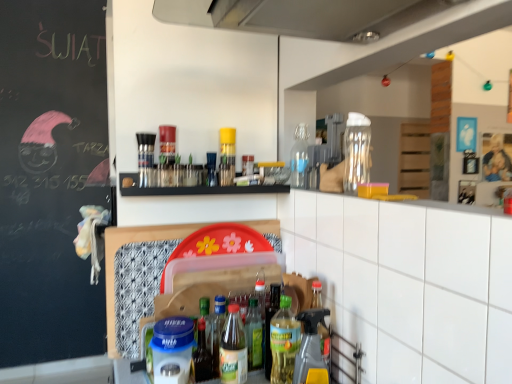
The height and width of the screenshot is (384, 512). What do you see at coordinates (202, 355) in the screenshot?
I see `translucent plastic bottle at center, the tenth bottle from the right` at bounding box center [202, 355].

Where is `translucent plastic bottle at center, acting as the 3th bottle starting from the left`? translucent plastic bottle at center, acting as the 3th bottle starting from the left is located at coordinates (211, 169).

Describe the element at coordinates (247, 165) in the screenshot. I see `translucent glass bottle at center, marked as the 6th bottle in a right-to-left arrangement` at that location.

Where is `transparent glass bottle at upper center, which is the first bottle in right-to-left order`? transparent glass bottle at upper center, which is the first bottle in right-to-left order is located at coordinates [x=356, y=152].

You are a GUI agent. You are given a task and a screenshot of the screen. Output one action in this format:
    pyautogui.click(x=<x>, y=<y>)
    Task: Click on the green glass bottle at center, which ranks as the fifth bottle in right-to-left order
    
    Given the screenshot: What is the action you would take?
    pyautogui.click(x=254, y=335)

Which object is further away from the camera, translucent plastic bottle at center, which is counted as the fifth bottle, starting from the left, or translucent plastic bottle at center, which is the second bottle in left-to-right order?

translucent plastic bottle at center, which is the second bottle in left-to-right order, is further away from the camera.

Is point (243, 345) farther from camera compared to point (202, 380)?

Yes, it is behind point (202, 380).

Is translucent plastic bottle at center, arranged as the seventh bottle when viewed from the right, oriented away from translucent plastic bottle at center, which is the second bottle in left-to-right order?

No, translucent plastic bottle at center, arranged as the seventh bottle when viewed from the right, is not facing the opposite direction of translucent plastic bottle at center, which is the second bottle in left-to-right order.

Is translucent plastic bottle at center, which is counted as the fifth bottle, starting from the left, thinner than translucent plastic bottle at center, which is the second bottle in left-to-right order?

No, translucent plastic bottle at center, which is counted as the fifth bottle, starting from the left, is not thinner than translucent plastic bottle at center, which is the second bottle in left-to-right order.

Between translucent plastic bottle at center, the tenth bottle from the right, and translucent plastic bottle at center, arranged as the seventh bottle when viewed from the right, which one has larger width?

With larger width is translucent plastic bottle at center, arranged as the seventh bottle when viewed from the right.

Is translucent plastic bottle at center, which is the second bottle in left-to-right order, positioned beyond the bounds of translucent plastic bottle at center, which is counted as the fifth bottle, starting from the left?

Absolutely, translucent plastic bottle at center, which is the second bottle in left-to-right order, is external to translucent plastic bottle at center, which is counted as the fifth bottle, starting from the left.

Is translucent plastic bottle at center, which is the second bottle in left-to-right order, aimed at translucent plastic bottle at center, which is counted as the fifth bottle, starting from the left?

No, translucent plastic bottle at center, which is the second bottle in left-to-right order, is not turned towards translucent plastic bottle at center, which is counted as the fifth bottle, starting from the left.

Would you consider translucent plastic bottle at center, which is counted as the fifth bottle, starting from the left, to be distant from transparent glass bottle at upper center, placed as the 2th bottle when sorted from right to left?

No, there isn't a large distance between translucent plastic bottle at center, which is counted as the fifth bottle, starting from the left, and transparent glass bottle at upper center, placed as the 2th bottle when sorted from right to left.

From the picture: Who is smaller, translucent plastic bottle at center, arranged as the seventh bottle when viewed from the right, or transparent glass bottle at upper center, placed as the 2th bottle when sorted from right to left?

With smaller size is translucent plastic bottle at center, arranged as the seventh bottle when viewed from the right.

Consider the image. Which object is thinner, translucent plastic bottle at center, arranged as the seventh bottle when viewed from the right, or transparent glass bottle at upper center, which is counted as the tenth bottle, starting from the left?

Thinner between the two is transparent glass bottle at upper center, which is counted as the tenth bottle, starting from the left.

From the image's perspective, is translucent plastic bottle at center, arranged as the seventh bottle when viewed from the right, located above or below transparent glass bottle at upper center, placed as the 2th bottle when sorted from right to left?

Based on their image positions, translucent plastic bottle at center, arranged as the seventh bottle when viewed from the right, is located beneath transparent glass bottle at upper center, placed as the 2th bottle when sorted from right to left.

Considering the points (212, 338) and (234, 334), which point is behind, point (212, 338) or point (234, 334)?

The point (212, 338) is farther from the camera.

I want to click on the 4th bottle below the translucent plastic bottle at center, the eighth bottle in the right-to-left sequence (from the image's perspective), so 233,349.

Who is more distant, translucent plastic bottle at center, the eighth bottle in the right-to-left sequence, or translucent plastic bottle at center, which is counted as the fifth bottle, starting from the left?

translucent plastic bottle at center, the eighth bottle in the right-to-left sequence.

Which is nearer, (x=207, y=153) or (x=294, y=342)?

The point (x=294, y=342) is closer to the camera.

Is translucent plastic bottle at center, the ninth bottle in the right-to-left sequence, placed right next to green glass bottle at center, the eighth bottle from the left?

No, translucent plastic bottle at center, the ninth bottle in the right-to-left sequence, is not in contact with green glass bottle at center, the eighth bottle from the left.

Who is taller, translucent plastic bottle at center, the ninth bottle in the right-to-left sequence, or green glass bottle at center, the fourth bottle viewed from the right?

Standing taller between the two is green glass bottle at center, the fourth bottle viewed from the right.

How much distance is there between translucent plastic bottle at center, acting as the 3th bottle starting from the left, and green glass bottle at center, the eighth bottle from the left?

translucent plastic bottle at center, acting as the 3th bottle starting from the left, is 20.89 inches from green glass bottle at center, the eighth bottle from the left.

Between green glass bottle at center, the eighth bottle from the left, and translucent plastic bottle at center, arranged as the seventh bottle when viewed from the right, which one has larger width?

green glass bottle at center, the eighth bottle from the left, is wider.

Considering the positions of point (283, 356) and point (225, 329), is point (283, 356) closer or farther from the camera than point (225, 329)?

Clearly, point (283, 356) is closer to the camera than point (225, 329).

Image resolution: width=512 pixels, height=384 pixels. I want to click on the 3rd bottle to the left of the green glass bottle at center, the fourth bottle viewed from the right, counting from the anchor's position, so click(x=233, y=349).

Is green glass bottle at center, the eighth bottle from the left, not close to translucent plastic bottle at center, arranged as the seventh bottle when viewed from the right?

No.

Could you measure the distance between translucent plastic bottle at center, the tenth bottle from the right, and translucent plastic bottle at center, the ninth bottle in the right-to-left sequence?

translucent plastic bottle at center, the tenth bottle from the right, and translucent plastic bottle at center, the ninth bottle in the right-to-left sequence, are 51.19 centimeters apart.

Considering the sizes of translucent plastic bottle at center, which is the second bottle in left-to-right order, and translucent plastic bottle at center, the ninth bottle in the right-to-left sequence, in the image, is translucent plastic bottle at center, which is the second bottle in left-to-right order, wider or thinner than translucent plastic bottle at center, the ninth bottle in the right-to-left sequence,?

translucent plastic bottle at center, which is the second bottle in left-to-right order, is wider than translucent plastic bottle at center, the ninth bottle in the right-to-left sequence.

Is translucent plastic bottle at center, which is the second bottle in left-to-right order, outside of translucent plastic bottle at center, the ninth bottle in the right-to-left sequence?

translucent plastic bottle at center, which is the second bottle in left-to-right order, lies outside translucent plastic bottle at center, the ninth bottle in the right-to-left sequence,'s area.

This screenshot has height=384, width=512. What are the coordinates of `bottle that is the 1st object located behind the translucent plastic bottle at center, arranged as the seventh bottle when viewed from the right` in the screenshot? It's located at (202, 355).

Identify the location of the 1st bottle in front of the translucent plastic bottle at center, which is the second bottle in left-to-right order, counting from the anchor's position. The image size is (512, 384). (233, 349).

Based on their spatial positions, is translucent plastic spray bottle at lower center, the 9th bottle when ordered from left to right, or green glass bottle at center, which ranks as the fifth bottle in right-to-left order, closer to translucent plastic bottle at center, which is the second bottle in left-to-right order?

Among the two, green glass bottle at center, which ranks as the fifth bottle in right-to-left order, is located nearer to translucent plastic bottle at center, which is the second bottle in left-to-right order.

Looking at the image, which one is located further to translucent glass bottle at center, the 6th bottle when ordered from left to right, translucent plastic bottle at center, arranged as the seventh bottle when viewed from the right, or translucent plastic bottle at center, the ninth bottle in the right-to-left sequence?

translucent plastic bottle at center, arranged as the seventh bottle when viewed from the right, lies further to translucent glass bottle at center, the 6th bottle when ordered from left to right, than the other object.

From the image, which object appears to be nearer to green glass bottle at center, acting as the seventh bottle starting from the left, transparent glass bottle at upper center, placed as the eleventh bottle when sorted from left to right, or translucent plastic bottle at center, arranged as the seventh bottle when viewed from the right?

Among the two, translucent plastic bottle at center, arranged as the seventh bottle when viewed from the right, is located nearer to green glass bottle at center, acting as the seventh bottle starting from the left.

Based on their spatial positions, is green glass bottle at center, acting as the seventh bottle starting from the left, or translucent plastic bottle at center, the tenth bottle from the right, further from translucent plastic bottle at center, arranged as the fourth bottle when viewed from the left?

green glass bottle at center, acting as the seventh bottle starting from the left, is further to translucent plastic bottle at center, arranged as the fourth bottle when viewed from the left.

When comparing their distances from translucent glass bottle at center, the first bottle from the left, does green glass bottle at center, the eighth bottle from the left, or translucent plastic spray bottle at lower center, the 9th bottle when ordered from left to right, seem further?

The object further to translucent glass bottle at center, the first bottle from the left, is translucent plastic spray bottle at lower center, the 9th bottle when ordered from left to right.

Which object lies further to the anchor point green glass bottle at center, acting as the seventh bottle starting from the left, translucent plastic bottle at center, which is counted as the fifth bottle, starting from the left, or transparent glass bottle at upper center, which is the first bottle in right-to-left order?

transparent glass bottle at upper center, which is the first bottle in right-to-left order, lies further to green glass bottle at center, acting as the seventh bottle starting from the left, than the other object.

Estimate the real-world distances between objects in this image. Which object is closer to translucent plastic bottle at center, arranged as the fourth bottle when viewed from the left, green glass bottle at center, which ranks as the fifth bottle in right-to-left order, or green glass bottle at center, the eighth bottle from the left?

Among the two, green glass bottle at center, which ranks as the fifth bottle in right-to-left order, is located nearer to translucent plastic bottle at center, arranged as the fourth bottle when viewed from the left.

From the image, which object appears to be farther from green glass bottle at center, the eighth bottle from the left, green glass bottle at center, acting as the seventh bottle starting from the left, or translucent plastic spray bottle at lower center, the 9th bottle when ordered from left to right?

Among the two, green glass bottle at center, acting as the seventh bottle starting from the left, is located further to green glass bottle at center, the eighth bottle from the left.

Locate an element on the screen. bottle between translucent plastic bottle at center, acting as the 3th bottle starting from the left, and translucent plastic spray bottle at lower center, the 9th bottle when ordered from left to right, from top to bottom is located at coordinates coord(216,331).

The image size is (512, 384). I want to click on bottle between translucent plastic bottle at center, arranged as the seventh bottle when viewed from the right, and translucent plastic bottle at center, arranged as the fourth bottle when viewed from the left, from front to back, so click(202, 355).

Where is `bottle between translucent glass bottle at center, the 6th bottle when ordered from left to right, and translucent plastic bottle at center, arranged as the fourth bottle when viewed from the left, from top to bottom`? The image size is (512, 384). bottle between translucent glass bottle at center, the 6th bottle when ordered from left to right, and translucent plastic bottle at center, arranged as the fourth bottle when viewed from the left, from top to bottom is located at coordinates (211, 169).